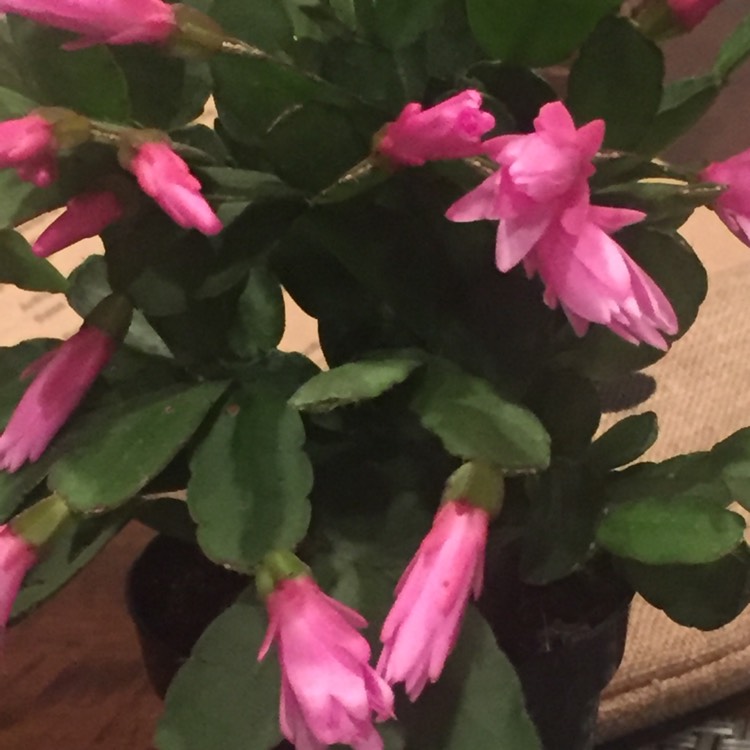
This screenshot has width=750, height=750. What are the coordinates of `table` in the screenshot? It's located at (117, 648).